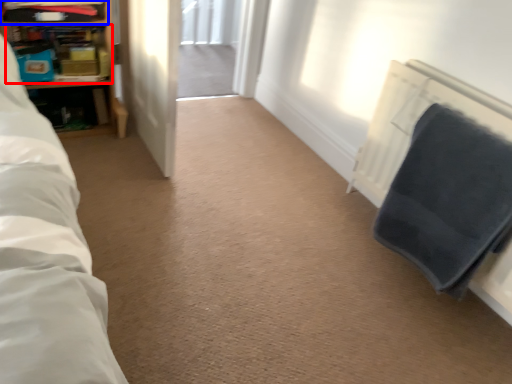
Question: Which object is further to the camera taking this photo, shelf (highlighted by a red box) or shelf (highlighted by a blue box)?

Choices:
 (A) shelf
 (B) shelf

Answer: (A)